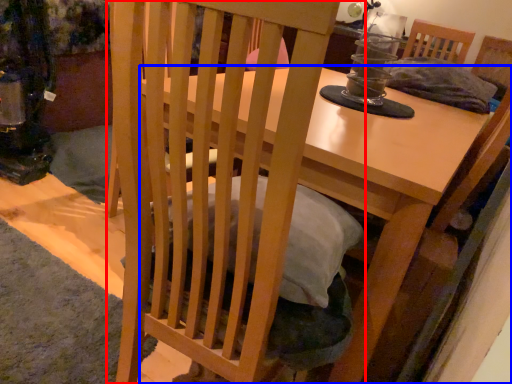
Question: Which point is further to the camera, chair (highlighted by a red box) or table (highlighted by a blue box)?

Choices:
 (A) chair
 (B) table

Answer: (B)